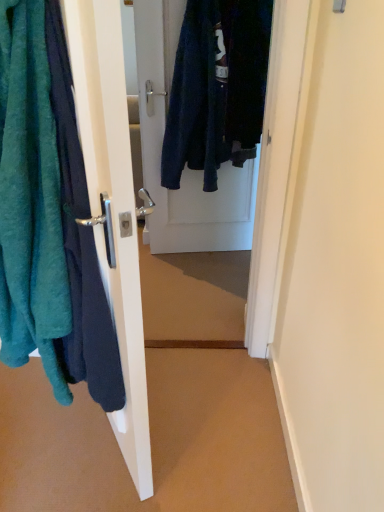
Where is `vacant space underneath teal fuzzy towel at left (from a real-world perspective)`? vacant space underneath teal fuzzy towel at left (from a real-world perspective) is located at coordinates (62, 466).